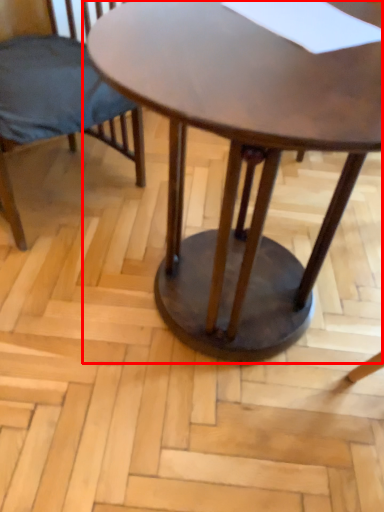
Question: From the image's perspective, considering the relative positions of coffee table (annotated by the red box) and chair in the image provided, where is coffee table (annotated by the red box) located with respect to the staircase?

Choices:
 (A) above
 (B) below

Answer: (B)